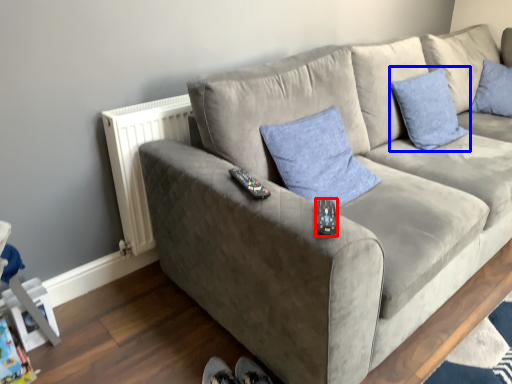
Question: Among these objects, which one is farthest to the camera, remote (highlighted by a red box) or pillow (highlighted by a blue box)?

Choices:
 (A) remote
 (B) pillow

Answer: (B)